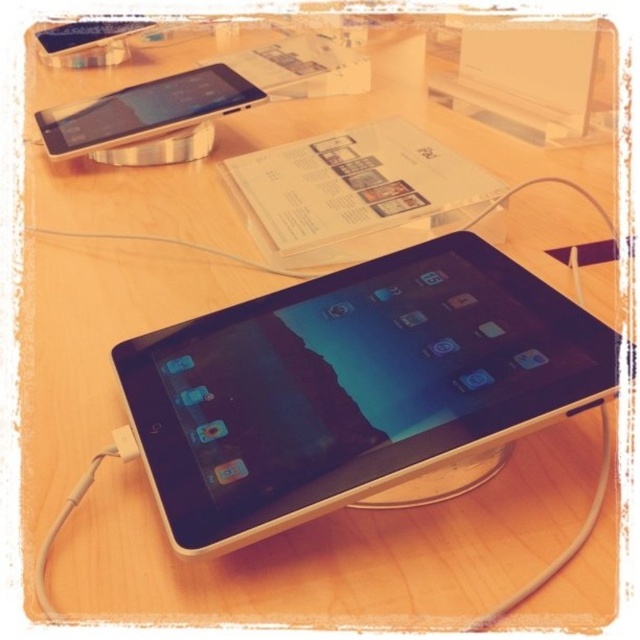
Between black glossy tablet at center and satin silver phone at upper left, which one appears on the right side from the viewer's perspective?

From the viewer's perspective, black glossy tablet at center appears more on the right side.

Is black glossy tablet at center above satin silver phone at upper left?

No.

Who is more distant from viewer, [161,420] or [236,74]?

Positioned behind is point [236,74].

At what (x,y) coordinates should I click in order to perform the action: click on black glossy tablet at center. Please return your answer as a coordinate pair (x, y). The image size is (640, 640). Looking at the image, I should click on (352, 385).

Is black glossy tablet at center shorter than satin silver ipod at upper left?

Incorrect, black glossy tablet at center's height does not fall short of satin silver ipod at upper left's.

Where is `black glossy tablet at center`? The width and height of the screenshot is (640, 640). black glossy tablet at center is located at coordinates (352, 385).

Who is more distant from viewer, (x=536, y=387) or (x=122, y=33)?

The point (x=122, y=33) is behind.

I want to click on black glossy tablet at center, so point(352,385).

Between satin silver phone at upper left and satin silver ipod at upper left, which one is positioned lower?

satin silver phone at upper left is lower down.

Which is in front, point (104, 115) or point (108, 32)?

Positioned in front is point (104, 115).

Does point (152, 93) come farther from viewer compared to point (48, 58)?

No, it is in front of (48, 58).

Identify the location of satin silver phone at upper left. (145, 109).